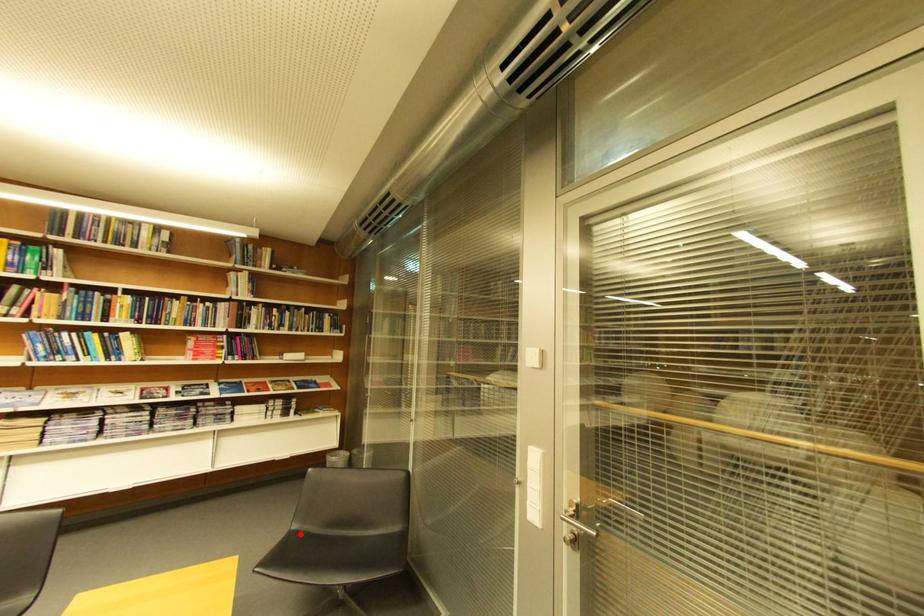
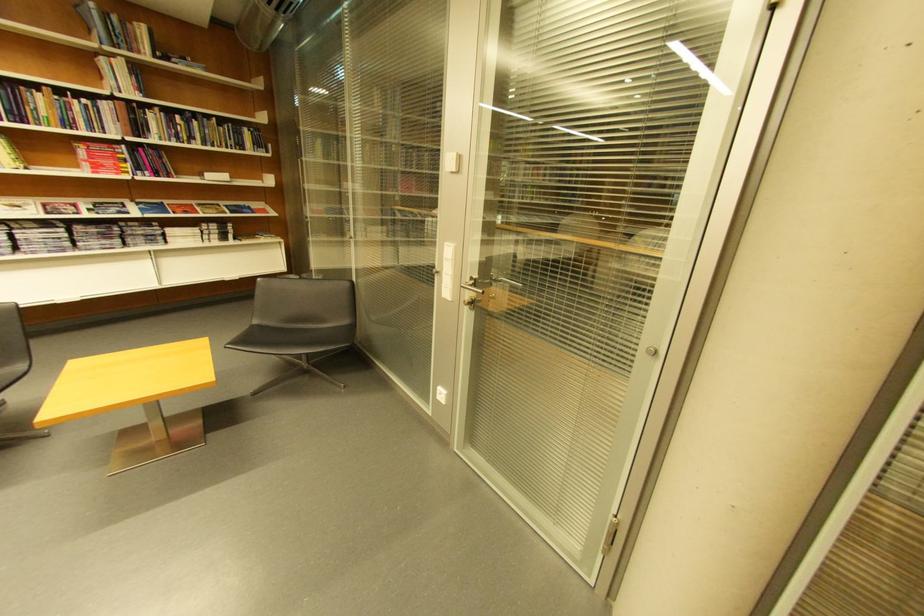
Locate, in the second image, the point that corresponds to the highlighted location in the first image.

(262, 329)